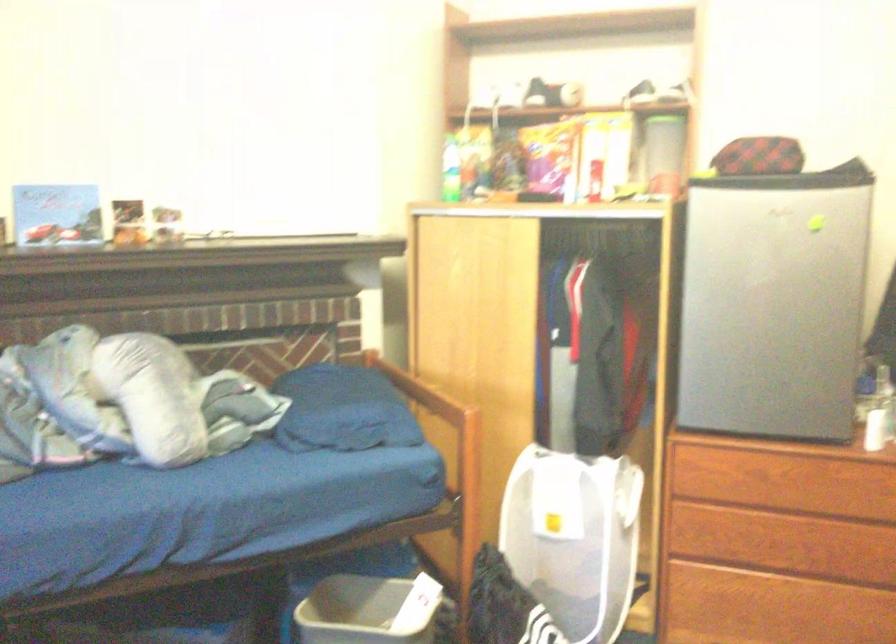
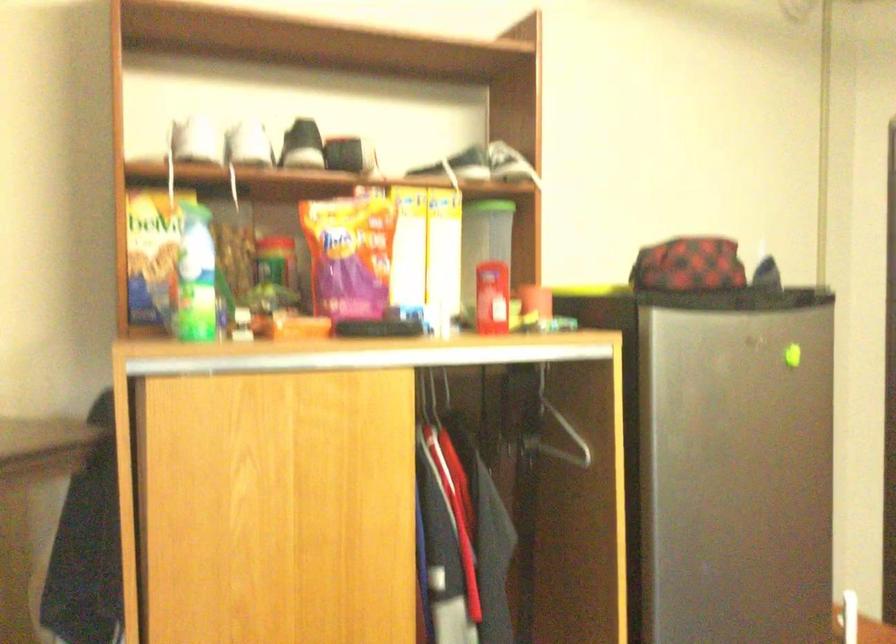
Find the pixel in the second image that matches pixel 599 180 in the first image.

(492, 297)